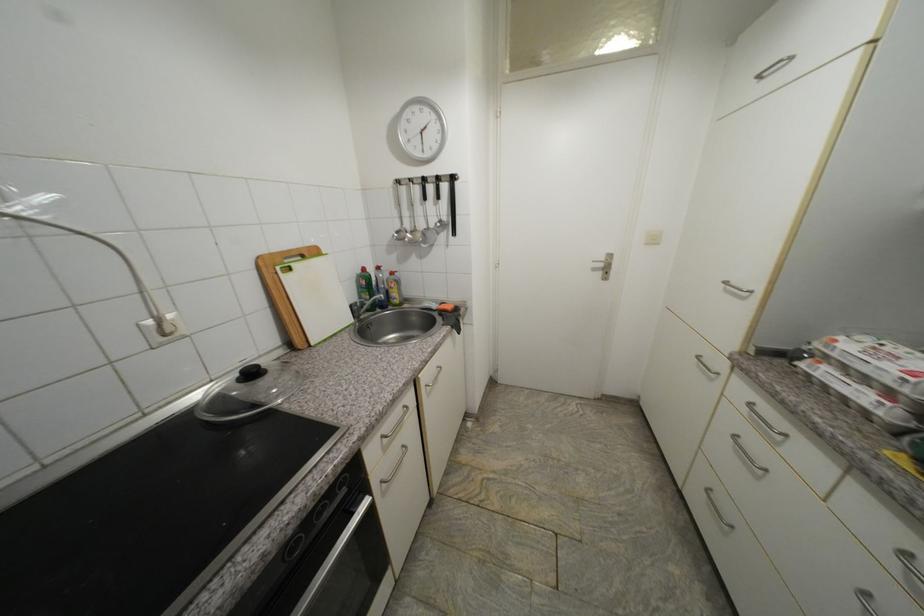
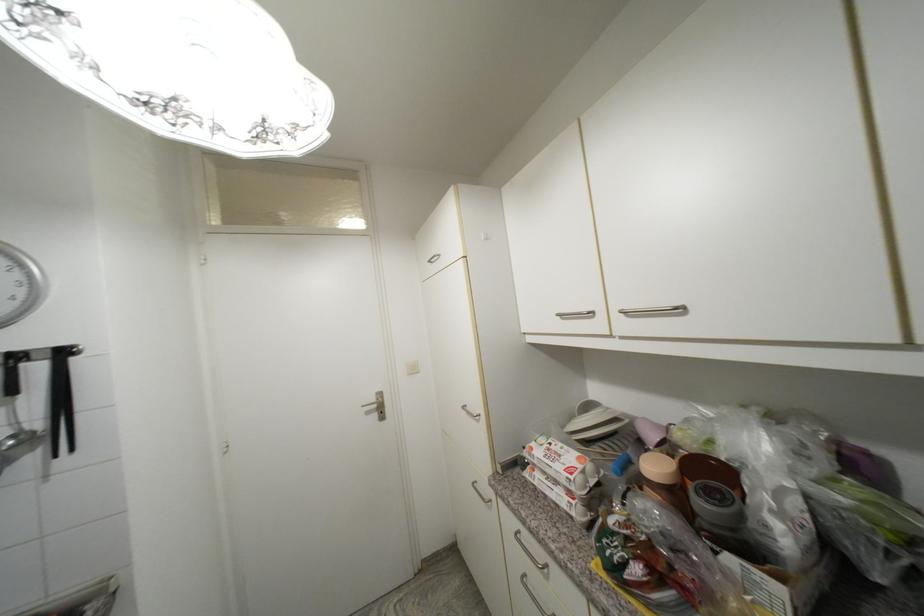
The images are taken continuously from a first-person perspective. In which direction is your viewpoint rotating?

The rotation direction of the camera is right-up.